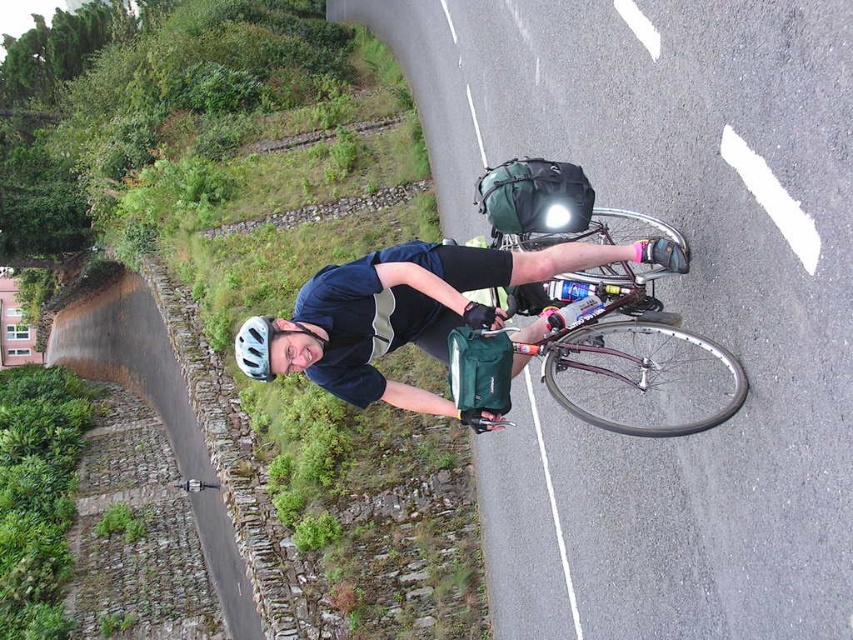
Who is positioned more to the left, matte black helmet at upper center or white matte bicycle helmet at upper center?

white matte bicycle helmet at upper center is more to the left.

Which is in front, point (625, 257) or point (259, 365)?

Point (625, 257)

At what (x,y) coordinates should I click in order to perform the action: click on matte black helmet at upper center. Please return your answer as a coordinate pair (x, y). The height and width of the screenshot is (640, 853). Looking at the image, I should click on (418, 308).

The width and height of the screenshot is (853, 640). I want to click on matte black helmet at upper center, so click(x=418, y=308).

Does shiny metallic bicycle at right have a lesser height compared to white matte bicycle helmet at upper center?

Incorrect, shiny metallic bicycle at right's height does not fall short of white matte bicycle helmet at upper center's.

The width and height of the screenshot is (853, 640). Find the location of `shiny metallic bicycle at right`. shiny metallic bicycle at right is located at coordinates (633, 356).

What do you see at coordinates (418, 308) in the screenshot? This screenshot has width=853, height=640. I see `matte black helmet at upper center` at bounding box center [418, 308].

The width and height of the screenshot is (853, 640). I want to click on matte black helmet at upper center, so click(x=418, y=308).

I want to click on matte black helmet at upper center, so click(x=418, y=308).